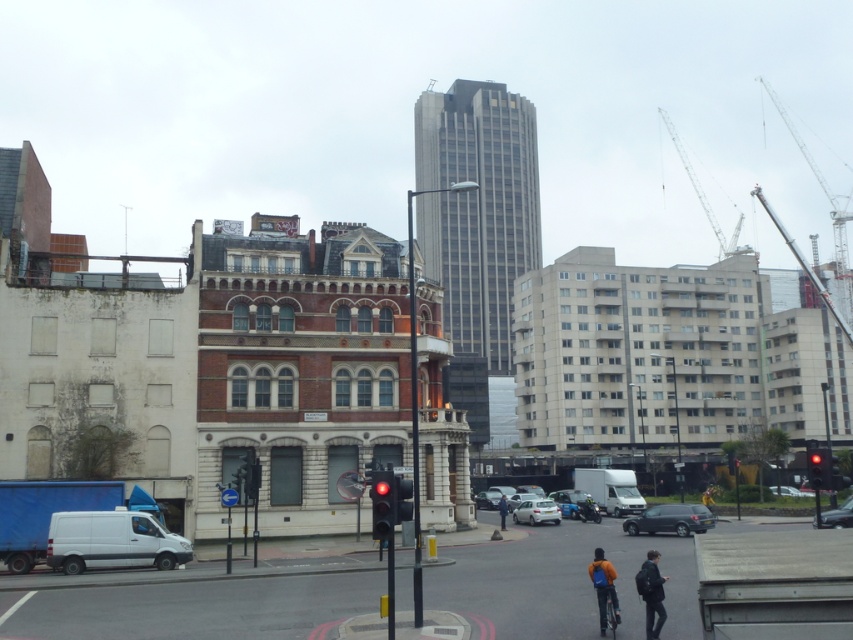
Between point (701, 202) and point (770, 492), which one is positioned in front?

Point (770, 492) is in front.

Can you confirm if metallic gray crane at upper right is smaller than metallic silver car at center?

Incorrect, metallic gray crane at upper right is not smaller in size than metallic silver car at center.

Locate an element on the screen. The image size is (853, 640). metallic gray crane at upper right is located at coordinates (706, 198).

Does red glass traffic light at center have a lesser height compared to dark blue jacket at center?

Incorrect, red glass traffic light at center's height does not fall short of dark blue jacket at center's.

Can you confirm if red glass traffic light at center is positioned to the right of dark blue jacket at center?

No, red glass traffic light at center is not to the right of dark blue jacket at center.

Describe the element at coordinates (381, 502) in the screenshot. I see `red glass traffic light at center` at that location.

Locate an element on the screen. red glass traffic light at center is located at coordinates (381, 502).

Between red glass traffic light at center and silver metallic hatchback at center, which one appears on the right side from the viewer's perspective?

silver metallic hatchback at center is more to the right.

What do you see at coordinates (381, 502) in the screenshot? Image resolution: width=853 pixels, height=640 pixels. I see `red glass traffic light at center` at bounding box center [381, 502].

Who is more forward, (372, 500) or (540, 509)?

Positioned in front is point (372, 500).

You are a GUI agent. You are given a task and a screenshot of the screen. Output one action in this format:
    pyautogui.click(x=<x>, y=<y>)
    Task: Click on the red glass traffic light at center
    This screenshot has height=640, width=853.
    Given the screenshot: What is the action you would take?
    pyautogui.click(x=381, y=502)